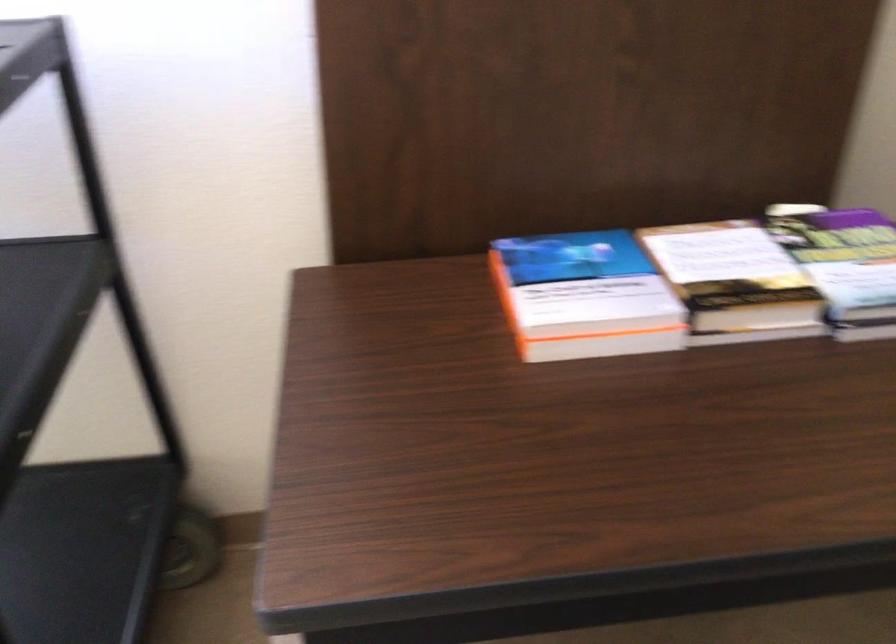
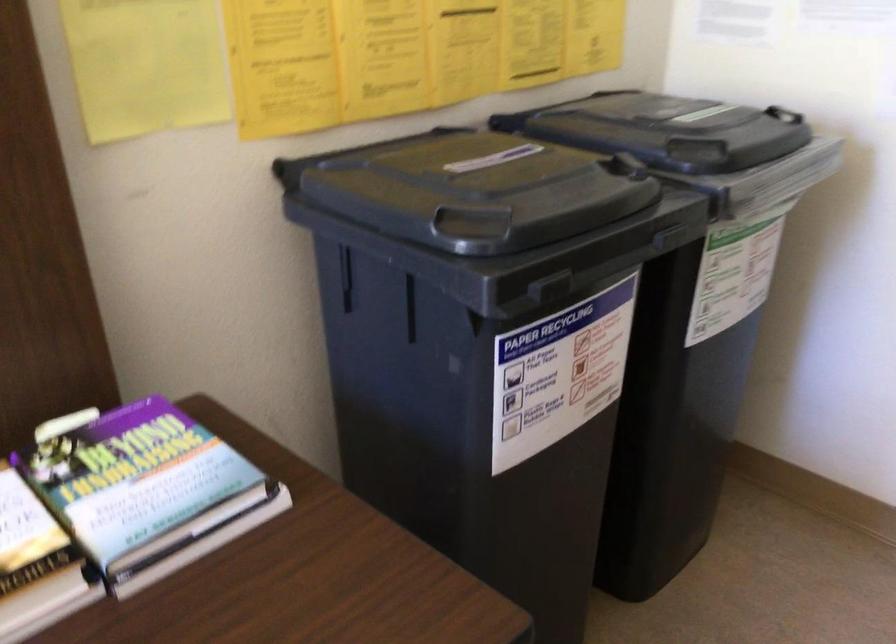
Question: Based on the continuous images, in which direction is the camera rotating? Reply with the corresponding letter.

Choices:
 (A) Left
 (B) Right
 (C) Up
 (D) Down

Answer: (B)